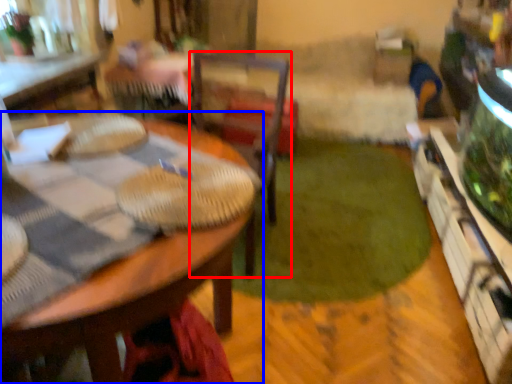
Question: Which object is further to the camera taking this photo, chair (highlighted by a red box) or table (highlighted by a blue box)?

Choices:
 (A) chair
 (B) table

Answer: (A)